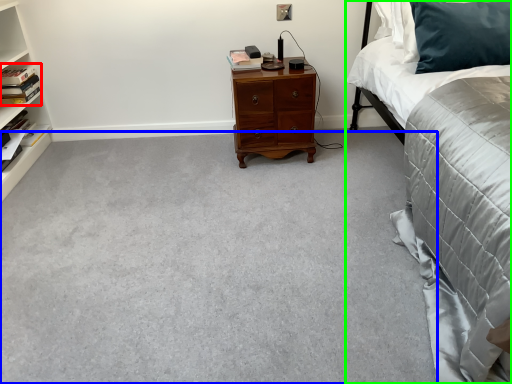
Question: Based on their relative distances, which object is farther from book (highlighted by a red box)? Choose from plain (highlighted by a blue box) and bed (highlighted by a green box).

Choices:
 (A) plain
 (B) bed

Answer: (B)